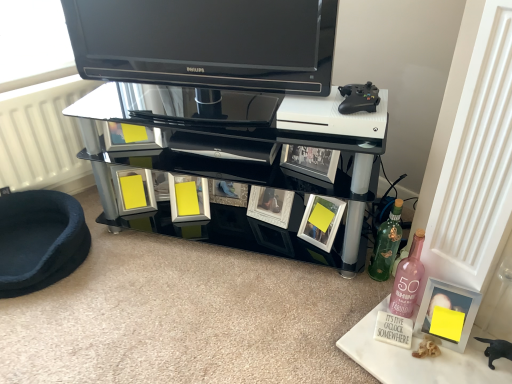
At what (x,y) coordinates should I click in order to perform the action: click on vacant space to the right of dark blue plush pet bed at lower left. Please return your answer as a coordinate pair (x, y). The height and width of the screenshot is (384, 512). Looking at the image, I should click on (135, 268).